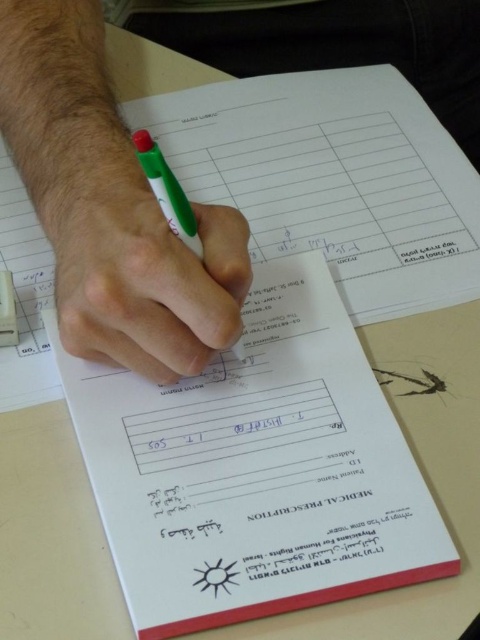
You are a medical student observing a doctor writing a prescription. The doctor points to two points on the prescription form. The first point is at coordinate point [336,470] and the second point is at coordinate point [146,154]. Which point is closer to the edge of the prescription form?

Based on the coordinates provided, point [146,154] is closer to the edge of the prescription form compared to point [336,470].